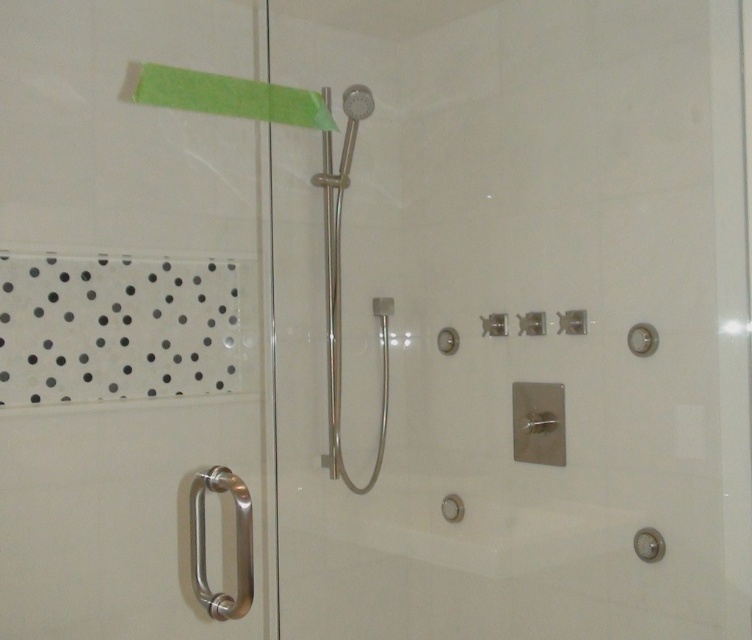
Question: Which object is closer to the camera taking this photo?

Choices:
 (A) polished chrome shower head at center
 (B) satin nickel showerhead at upper center

Answer: (B)

Question: Which point is closer to the camera taking this photo?

Choices:
 (A) (338, 385)
 (B) (371, 99)

Answer: (B)

Question: Is polished chrome shower head at center below satin nickel showerhead at upper center?

Choices:
 (A) yes
 (B) no

Answer: (A)

Question: Which object appears closest to the camera in this image?

Choices:
 (A) polished chrome shower head at center
 (B) satin nickel showerhead at upper center

Answer: (B)

Question: Where is polished chrome shower head at center located in relation to satin nickel showerhead at upper center in the image?

Choices:
 (A) right
 (B) left

Answer: (B)

Question: Is polished chrome shower head at center below satin nickel showerhead at upper center?

Choices:
 (A) yes
 (B) no

Answer: (A)